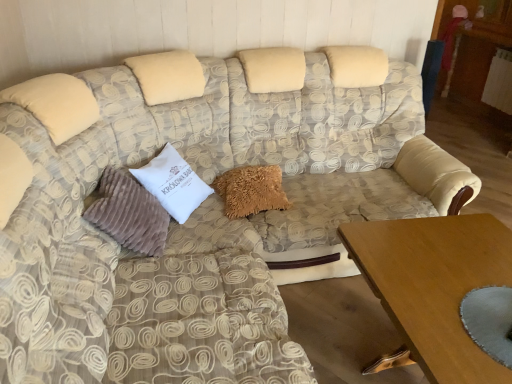
The width and height of the screenshot is (512, 384). Identify the location of empty space that is ontop of wooden table at lower right (from a real-world perspective). (451, 269).